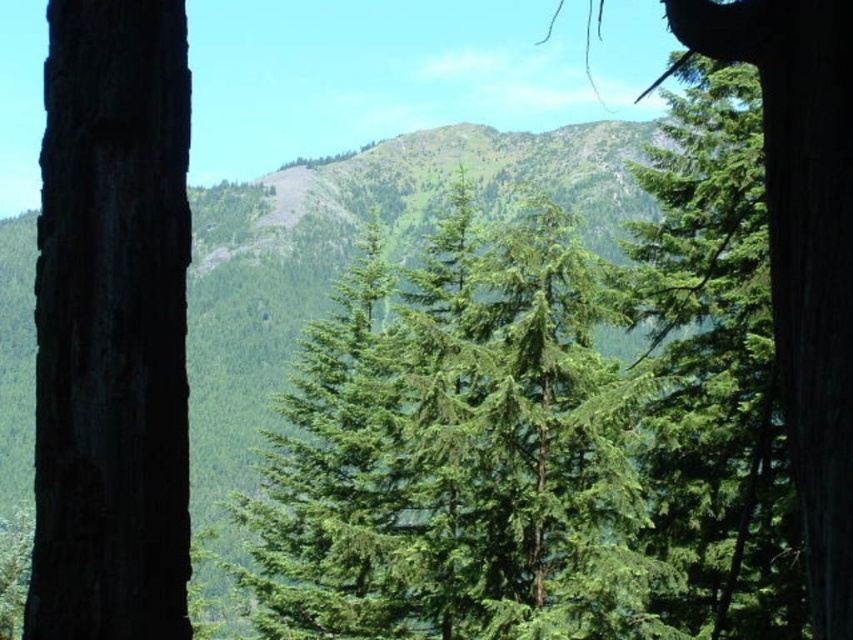
Does green needle-like tree at center have a greater height compared to dark brown rough bark at left?

Indeed, green needle-like tree at center has a greater height compared to dark brown rough bark at left.

Who is more forward, (549, 634) or (35, 449)?

Positioned in front is point (35, 449).

Locate an element on the screen. green needle-like tree at center is located at coordinates (457, 452).